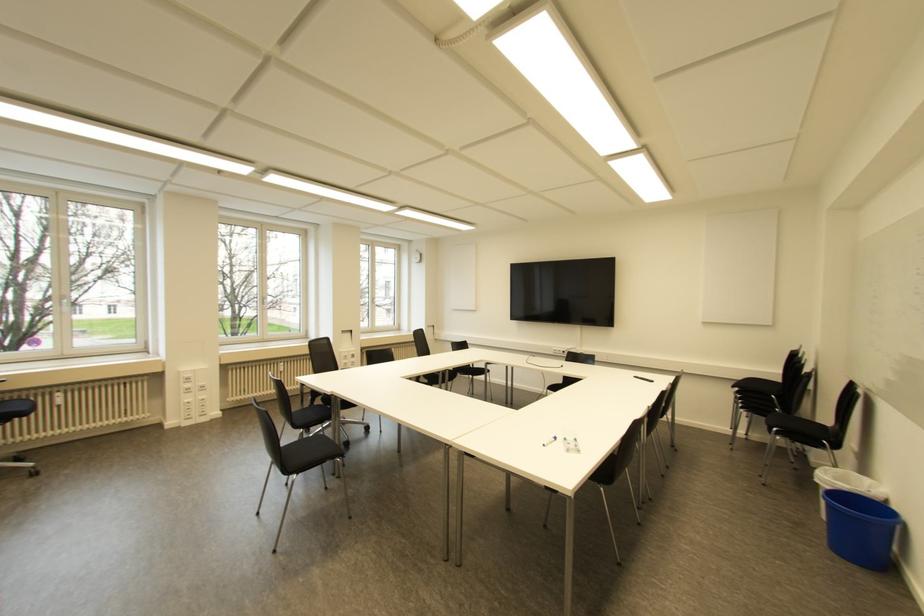
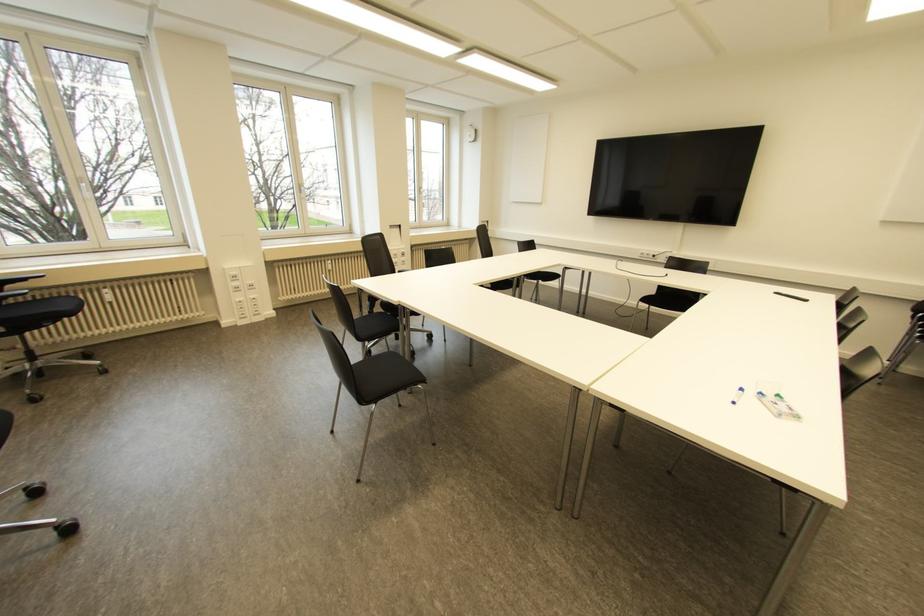
In the second image, find the point that corresponds to point (56, 394) in the first image.

(104, 290)